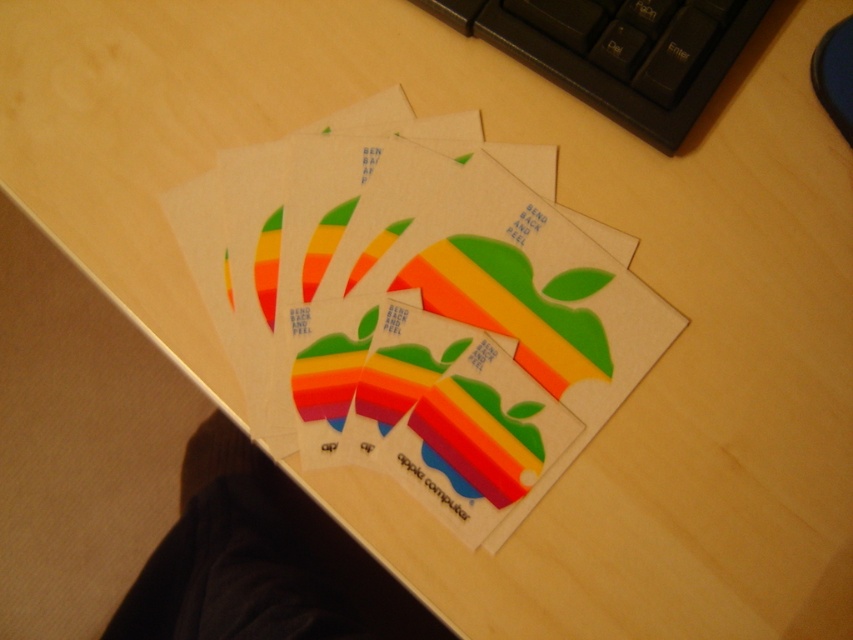
Question: Does matte paper card at center lie behind black plastic keyboard at upper center?

Choices:
 (A) no
 (B) yes

Answer: (A)

Question: Does matte paper card at center have a lesser width compared to black plastic keyboard at upper center?

Choices:
 (A) yes
 (B) no

Answer: (B)

Question: Which point is closer to the camera?

Choices:
 (A) (631, 108)
 (B) (587, 371)

Answer: (B)

Question: Does matte paper card at center have a larger size compared to black plastic keyboard at upper center?

Choices:
 (A) yes
 (B) no

Answer: (A)